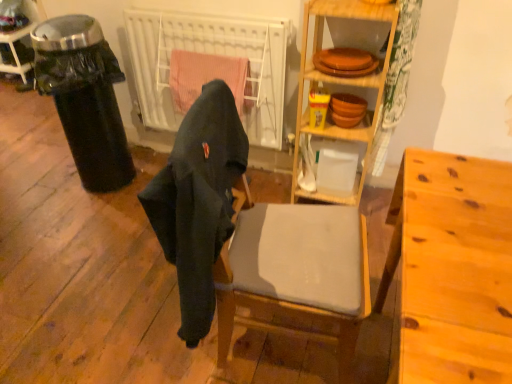
Question: From a real-world perspective, is matte gray cushioned chair at center below wooden shelves at center?

Choices:
 (A) no
 (B) yes

Answer: (B)

Question: Does matte gray cushioned chair at center have a lesser width compared to wooden shelves at center?

Choices:
 (A) no
 (B) yes

Answer: (A)

Question: Does matte gray cushioned chair at center lie behind wooden shelves at center?

Choices:
 (A) no
 (B) yes

Answer: (A)

Question: Considering the relative sizes of matte gray cushioned chair at center and wooden shelves at center in the image provided, is matte gray cushioned chair at center smaller than wooden shelves at center?

Choices:
 (A) no
 (B) yes

Answer: (A)

Question: Is matte gray cushioned chair at center not close to wooden shelves at center?

Choices:
 (A) no
 (B) yes

Answer: (A)

Question: From a real-world perspective, is matte gray cushioned chair at center above or below wooden shelves at center?

Choices:
 (A) above
 (B) below

Answer: (B)

Question: Is matte gray cushioned chair at center to the left or to the right of wooden shelves at center in the image?

Choices:
 (A) right
 (B) left

Answer: (B)

Question: From the image's perspective, relative to wooden shelves at center, is matte gray cushioned chair at center above or below?

Choices:
 (A) above
 (B) below

Answer: (B)

Question: In terms of size, does matte gray cushioned chair at center appear bigger or smaller than wooden shelves at center?

Choices:
 (A) big
 (B) small

Answer: (A)

Question: Looking at their shapes, would you say metallic trash can at left is wider or thinner than wooden shelves at center?

Choices:
 (A) wide
 (B) thin

Answer: (A)

Question: Relative to wooden shelves at center, is metallic trash can at left in front or behind?

Choices:
 (A) front
 (B) behind

Answer: (B)

Question: From the image's perspective, relative to wooden shelves at center, is metallic trash can at left above or below?

Choices:
 (A) below
 (B) above

Answer: (B)

Question: From a real-world perspective, relative to wooden shelves at center, is metallic trash can at left vertically above or below?

Choices:
 (A) above
 (B) below

Answer: (B)

Question: From the image's perspective, is black plastic trash can at left above or below dark gray fabric chair at center?

Choices:
 (A) above
 (B) below

Answer: (A)

Question: Looking at their shapes, would you say black plastic trash can at left is wider or thinner than dark gray fabric chair at center?

Choices:
 (A) wide
 (B) thin

Answer: (A)